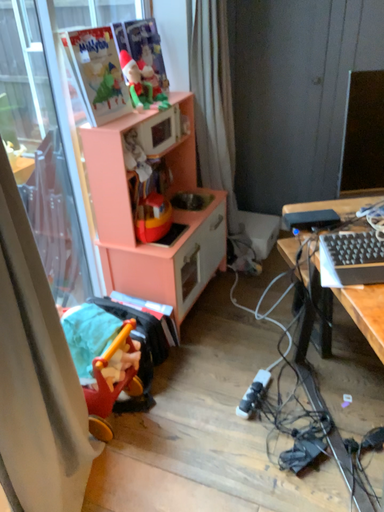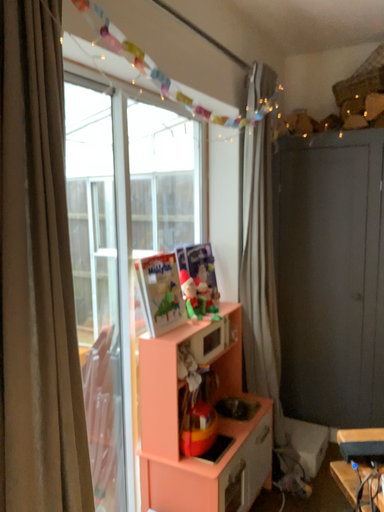
Question: Which way did the camera rotate in the video?

Choices:
 (A) rotated downward
 (B) rotated upward

Answer: (B)